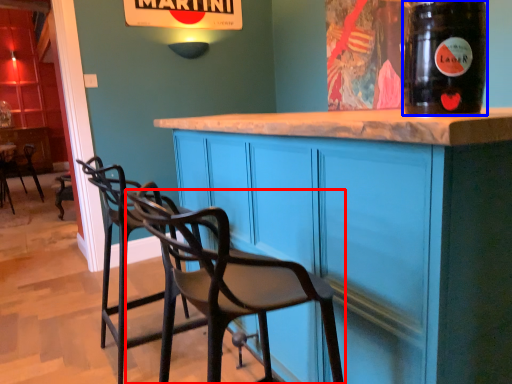
Question: Which point is closer to the camera, chair (highlighted by a red box) or drinking straw (highlighted by a blue box)?

Choices:
 (A) chair
 (B) drinking straw

Answer: (A)